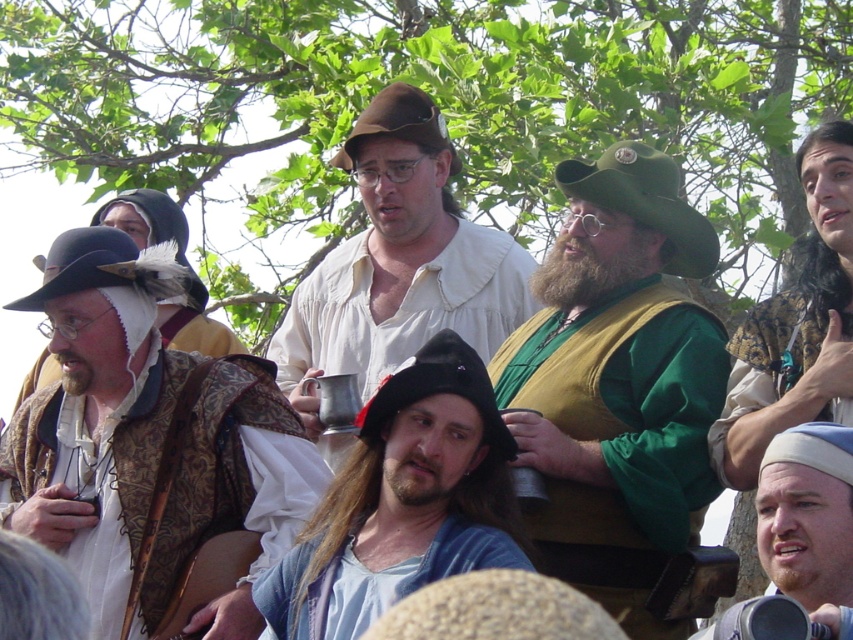
You are organizing a costume check for a renaissance fair and need to ensure that the white cotton shirt at center and the camouflage fabric vest at right fit properly. Which item has a larger width measurement?

The white cotton shirt at center might be wider than camouflage fabric vest at right.

You are standing in the middle of the renaissance fair crowd and see two points in the scene. The first point is at coordinates point (294, 390) and the second is at point (799, 470). Which point is closer to you?

Point (294, 390) is closer to you because it is further to the camera than point (799, 470).

You are standing in the middle of a renaissance fair and want to find the white cotton shirt at center. According to the map coordinates, where should you look to find it?

The white cotton shirt at center is located at the 2D coordinates point (397, 266).